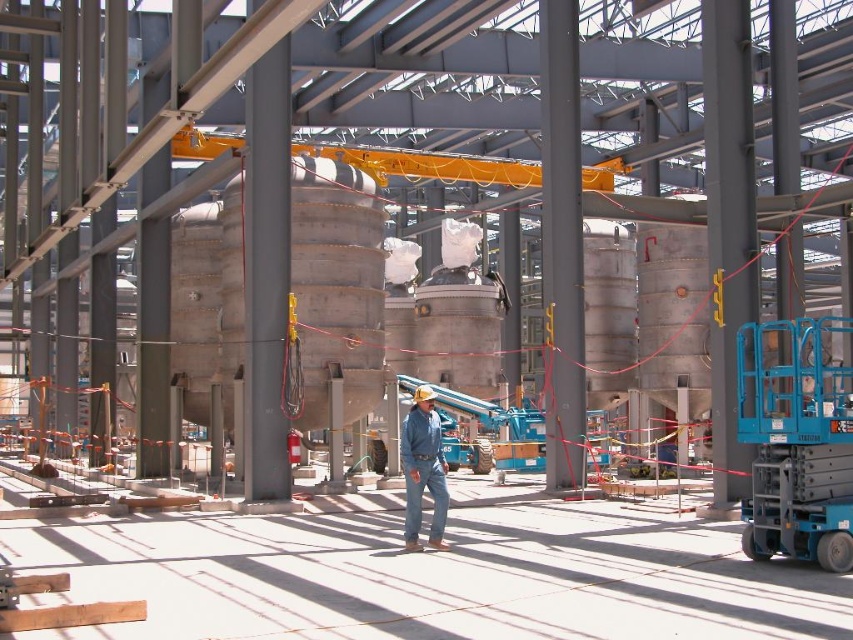
Who is more forward, (527, 452) or (412, 516)?

Point (412, 516) is more forward.

Is blue metallic forklift at center below denim at center?

Yes.

What do you see at coordinates (503, 428) in the screenshot?
I see `blue metallic forklift at center` at bounding box center [503, 428].

The width and height of the screenshot is (853, 640). I want to click on blue metallic forklift at center, so click(503, 428).

Is point (514, 428) closer to viewer compared to point (415, 401)?

No, (514, 428) is behind (415, 401).

Does blue metallic forklift at center come in front of blue denim jeans at center?

No, blue metallic forklift at center is behind blue denim jeans at center.

Is point (469, 403) farther from viewer compared to point (410, 545)?

Yes, it is.

Find the location of a particular element. This screenshot has height=640, width=853. blue metallic forklift at center is located at coordinates (503, 428).

Image resolution: width=853 pixels, height=640 pixels. Describe the element at coordinates (422, 468) in the screenshot. I see `blue denim jeans at center` at that location.

Which is in front, point (405, 538) or point (431, 536)?

Point (431, 536) is in front.

This screenshot has height=640, width=853. In order to click on blue denim jeans at center in this screenshot , I will do `click(422, 468)`.